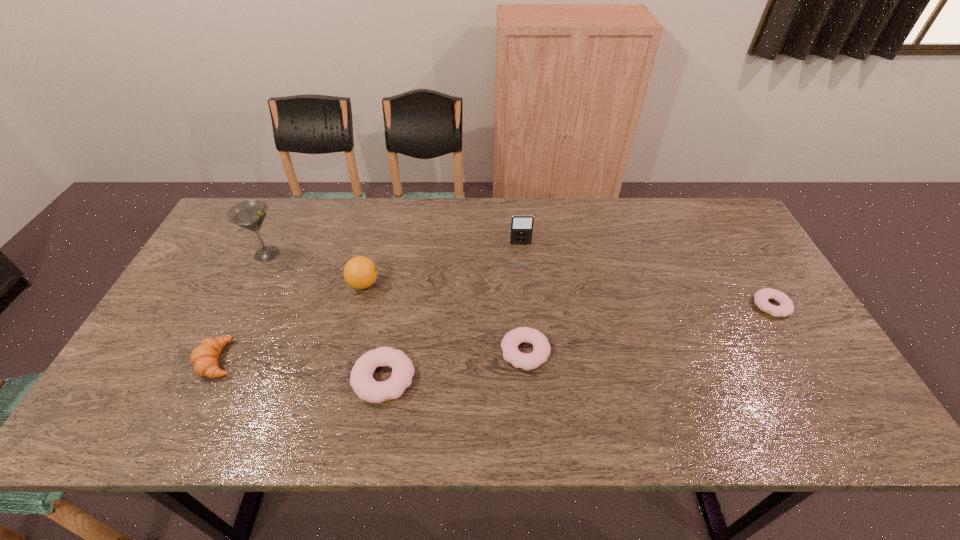
Identify the location of vacant point located 0.060m on the left of the tallest doughnut. The image size is (960, 540). (327, 379).

Identify the location of vacant space situated 0.090m on the back of the second shortest object. This screenshot has height=540, width=960. [521, 306].

Locate an element on the screen. vacant space situated 0.060m on the back of the rightmost doughnut is located at coordinates (755, 277).

Find the location of a particular element. The height and width of the screenshot is (540, 960). vacant area located on the front of the martini is located at coordinates (232, 325).

At what (x,y) coordinates should I click in order to perform the action: click on free region located on the front-facing side of the second tallest object. Please return your answer as a coordinate pair (x, y). Looking at the image, I should click on (521, 255).

At what (x,y) coordinates should I click in order to perform the action: click on free space located 0.300m on the side with brand of the third tallest object. Please return your answer as a coordinate pair (x, y). Looking at the image, I should click on (484, 284).

Where is `vacant area situated on the back of the fourth tallest object`? The width and height of the screenshot is (960, 540). vacant area situated on the back of the fourth tallest object is located at coordinates point(250,296).

Where is `martini located in the far edge section of the desktop`? The height and width of the screenshot is (540, 960). martini located in the far edge section of the desktop is located at coordinates (250, 214).

Locate an element on the screen. Image resolution: width=960 pixels, height=540 pixels. iPod positioned at the far edge is located at coordinates (521, 225).

Identify the location of crescent roll located at the near edge. (204, 358).